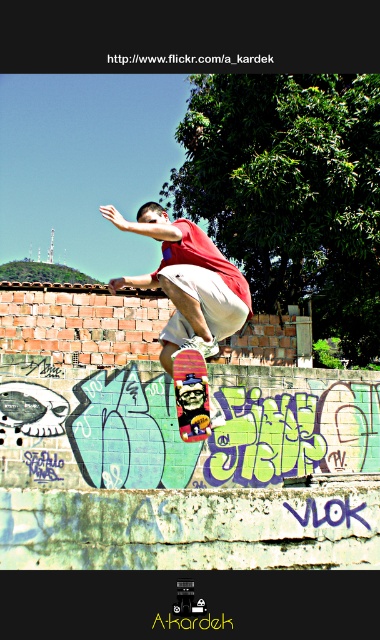
Who is higher up, matte red skateboard at center or multicolored wooden skateboard at center?

matte red skateboard at center

Measure the distance between matte red skateboard at center and multicolored wooden skateboard at center.

A distance of 6.68 feet exists between matte red skateboard at center and multicolored wooden skateboard at center.

Who is more forward, (x=172, y=252) or (x=183, y=346)?

Point (x=183, y=346) is more forward.

Find the location of a particular element. matte red skateboard at center is located at coordinates (178, 262).